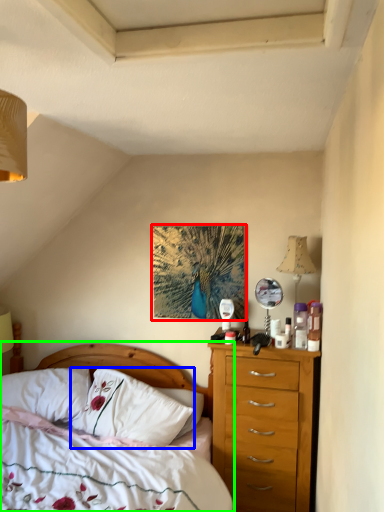
Question: Which object is the closest to the picture frame (highlighted by a red box)? Choose among these: pillow (highlighted by a blue box) or bed (highlighted by a green box).

Choices:
 (A) pillow
 (B) bed

Answer: (A)